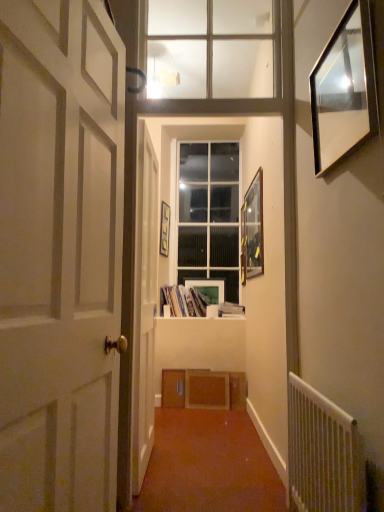
Question: Is wooden picture frame at right, the third picture frame from the back, spatially inside white paper book at center, which appears as the 2th book when viewed from the left, or outside of it?

Choices:
 (A) outside
 (B) inside

Answer: (A)

Question: From the image's perspective, relative to white paper book at center, which appears as the 2th book when viewed from the left, is wooden picture frame at right, which is counted as the 4th picture frame, starting from the left, above or below?

Choices:
 (A) above
 (B) below

Answer: (A)

Question: Which of these objects is positioned closest to the white painted wood door at left, which is the first door from front to back?

Choices:
 (A) matte paper books at center, arranged as the second book when viewed from the right
 (B) white paper book at center, arranged as the 1th book when viewed from the right
 (C) matte white picture frame at center, which appears as the 1th picture frame when viewed from the back
 (D) clear glass window at center, which is counted as the second window, starting from the front
 (E) clear glass window at upper center, which is the 1th window from front to back

Answer: (E)

Question: Which of these objects is positioned farthest from the white wooden door at center, which is the second door in front-to-back order?

Choices:
 (A) wooden window sill at center
 (B) wooden picture frame at right, which is the 2th picture frame from front to back
 (C) matte white picture frame at center, the third picture frame when ordered from right to left
 (D) matte paper books at center, the 1th book viewed from the left
 (E) wooden picture frame at center, which is the third picture frame in front-to-back order

Answer: (E)